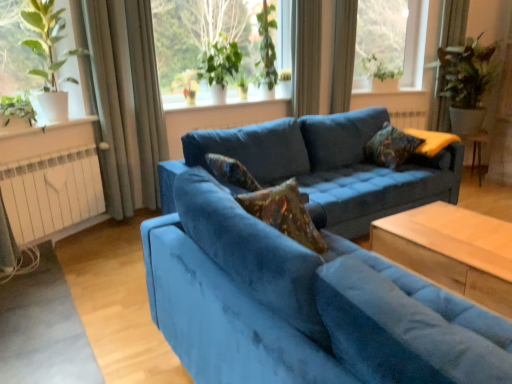
I want to click on free point below green leafy plant at upper center, the fourth plant in the right-to-left sequence (from a real-world perspective), so click(x=188, y=106).